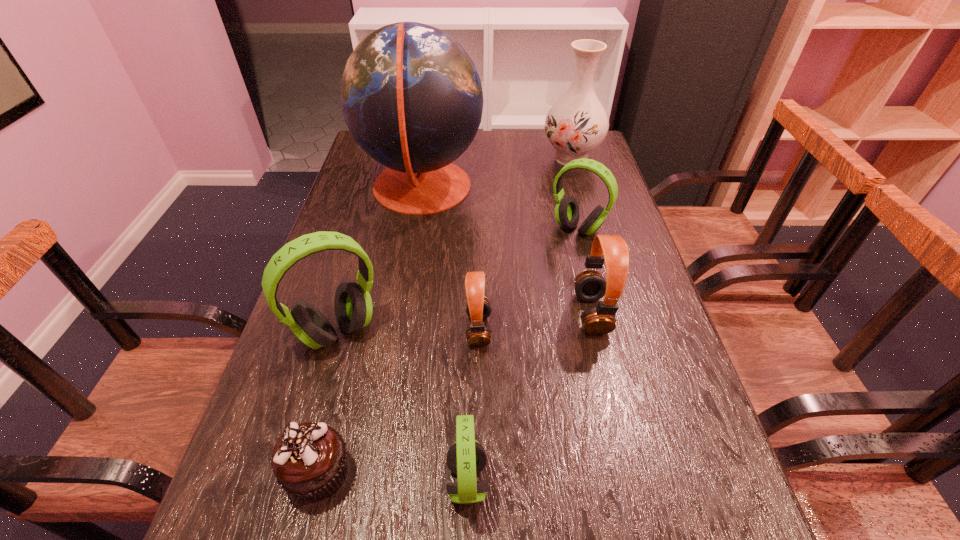
The image size is (960, 540). Find the location of `free space at the far edge of the desktop`. free space at the far edge of the desktop is located at coordinates (518, 141).

The width and height of the screenshot is (960, 540). Find the location of `vacant area at the left edge of the desktop`. vacant area at the left edge of the desktop is located at coordinates (358, 170).

Image resolution: width=960 pixels, height=540 pixels. I want to click on free space at the right edge, so click(666, 453).

At what (x,y) coordinates should I click in order to perform the action: click on vacant region at the far right corner of the desktop. Please return your answer as a coordinate pair (x, y). The width and height of the screenshot is (960, 540). Looking at the image, I should click on (599, 154).

Locate an element on the screen. This screenshot has height=540, width=960. vacant area that lies between the tallest object and the second farthest green headset is located at coordinates pyautogui.click(x=380, y=260).

Image resolution: width=960 pixels, height=540 pixels. What are the coordinates of `empty space that is in between the second green headset from left to right and the smaller brown headset` in the screenshot? It's located at (473, 405).

I want to click on free space between the farthest green headset and the seventh shortest object, so click(574, 193).

This screenshot has width=960, height=540. I want to click on unoccupied position between the globe and the second green headset from left to right, so click(444, 335).

What are the coordinates of `vacant area between the second biggest green headset and the smaller brown headset` in the screenshot? It's located at (528, 279).

Find the location of a particular element. The image size is (960, 540). blank region between the bigger brown headset and the nearest green headset is located at coordinates (530, 397).